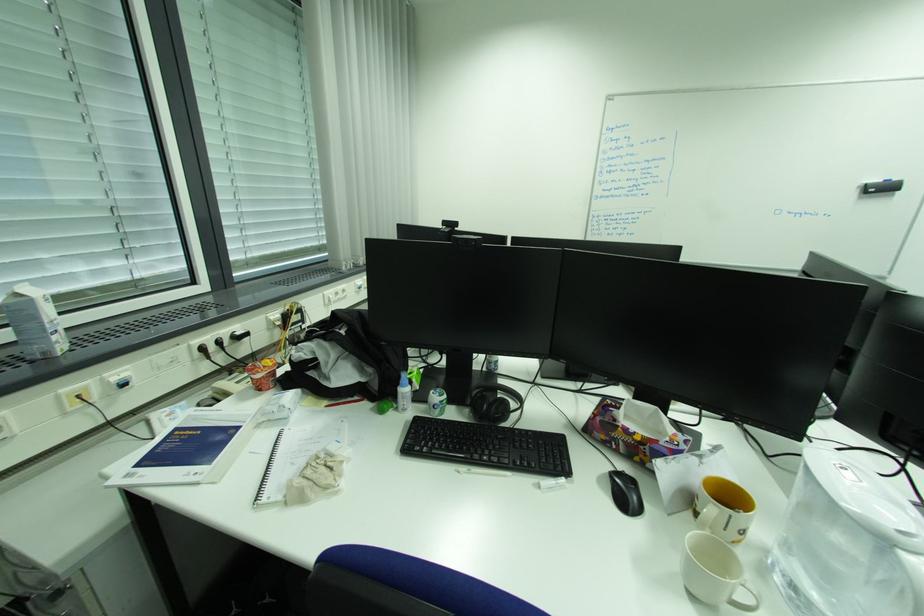
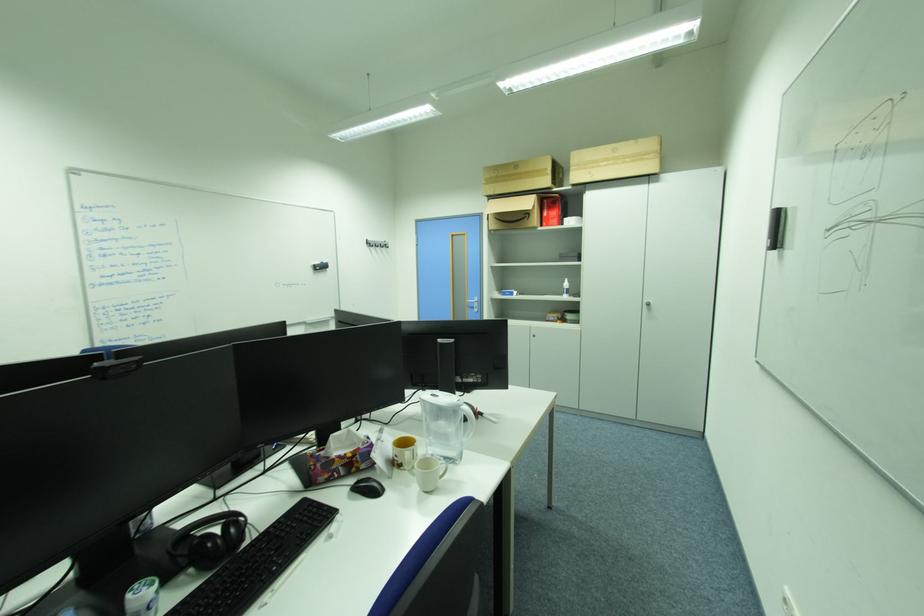
Question: The camera is either moving clockwise (left) or counter-clockwise (right) around the object. The first image is from the beginning of the video and the second image is from the end. Is the camera moving left or right when shooting the video?

Choices:
 (A) Left
 (B) Right

Answer: (A)